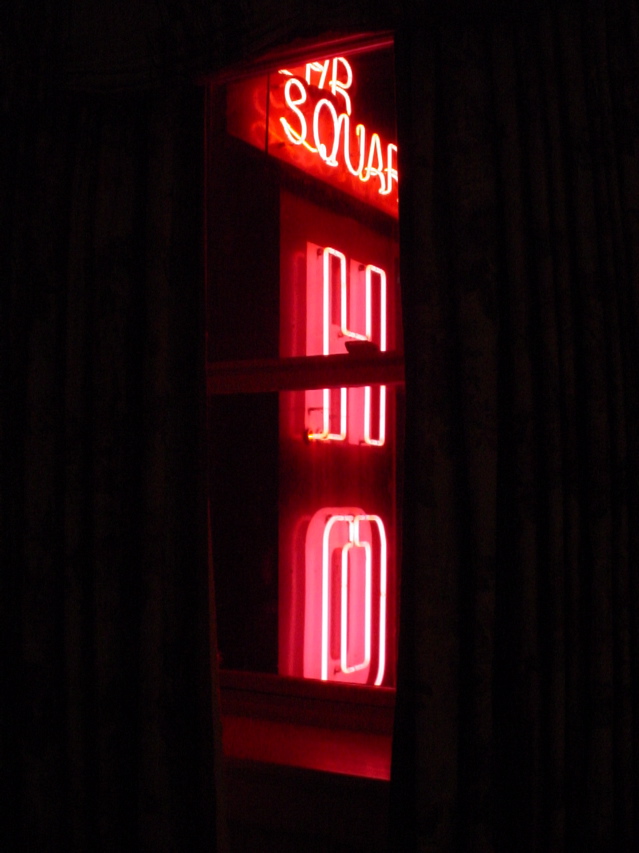
The image size is (639, 853). I want to click on window pane, so click(310, 703), click(319, 374), click(325, 49).